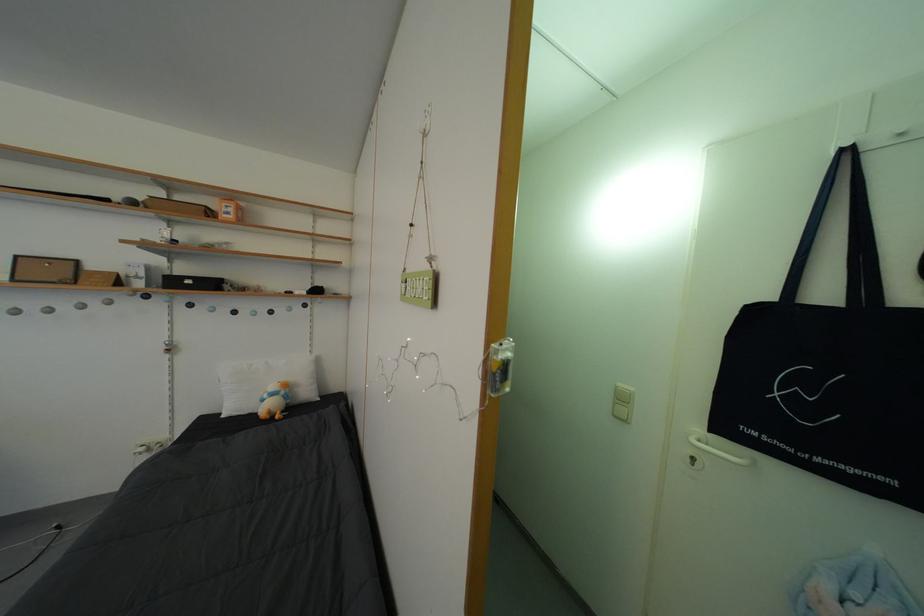
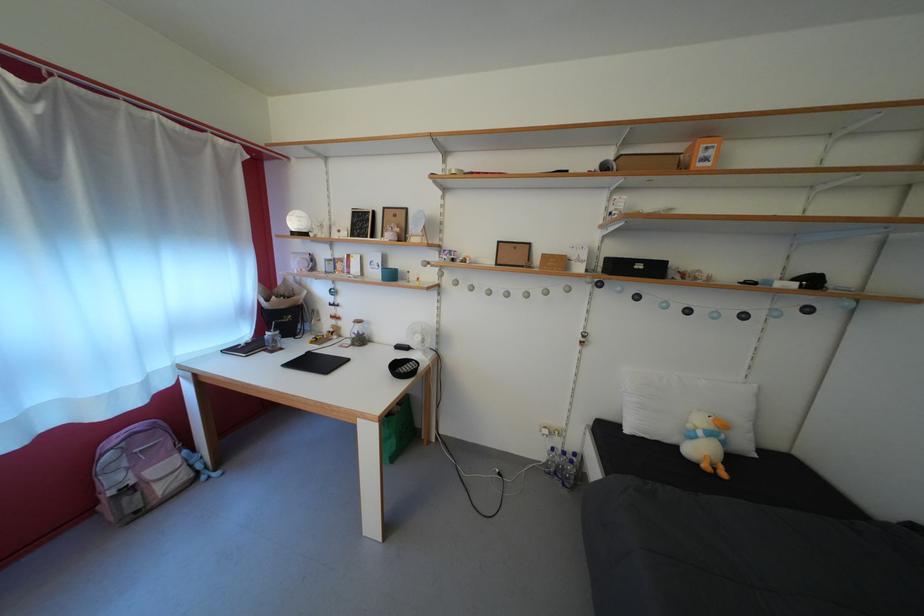
The point at (274, 400) is marked in the first image. Where is the corresponding point in the second image?

(709, 439)